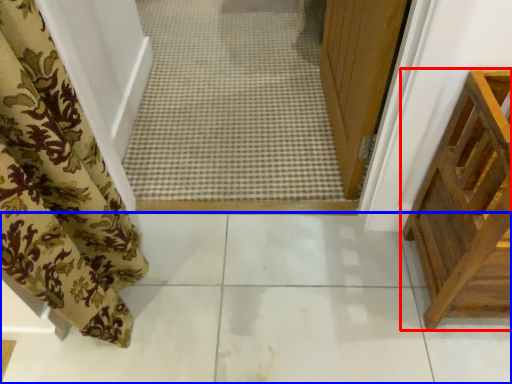
Question: Which point is closer to the camera, furniture (highlighted by a red box) or path (highlighted by a blue box)?

Choices:
 (A) furniture
 (B) path

Answer: (A)